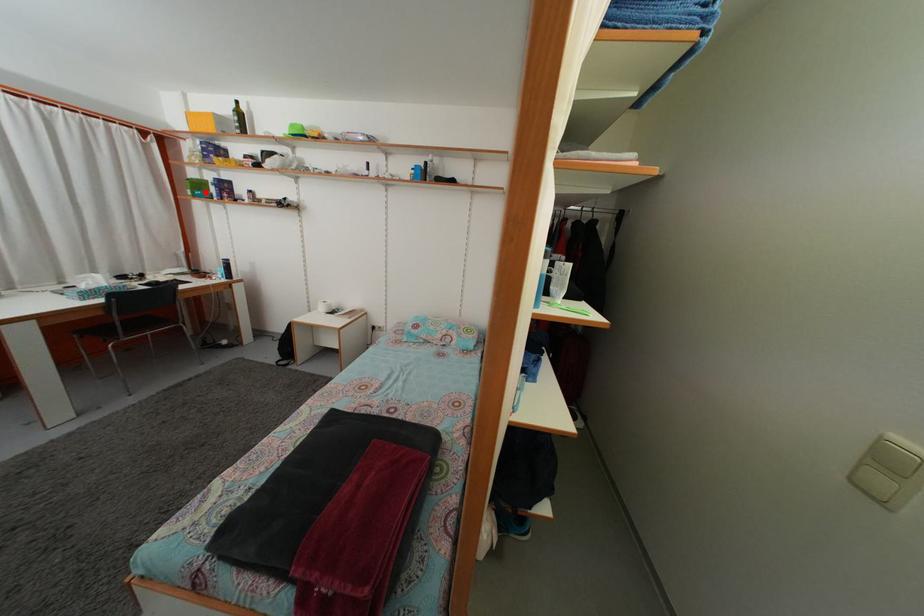
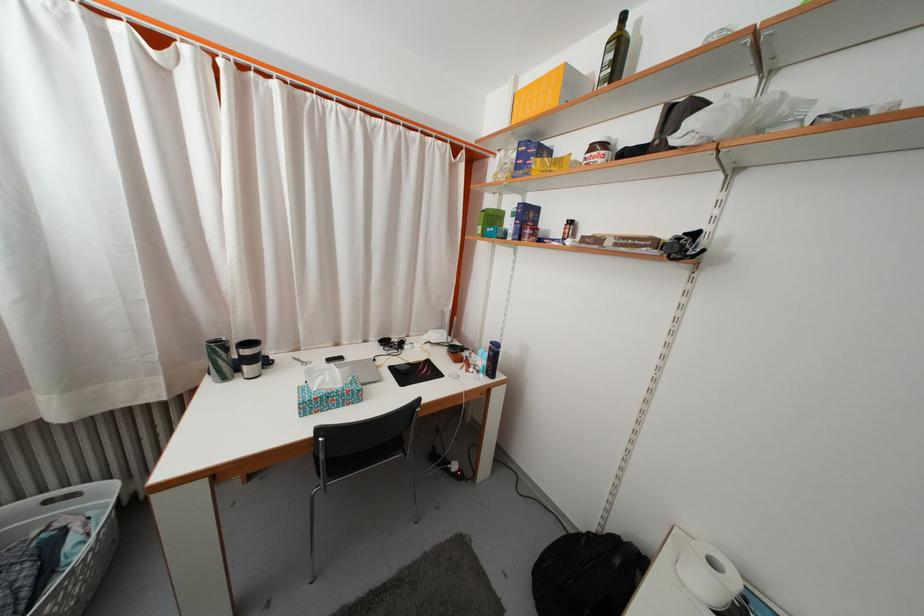
In the second image, find the point that corresponds to the highlighted location in the first image.

(500, 225)